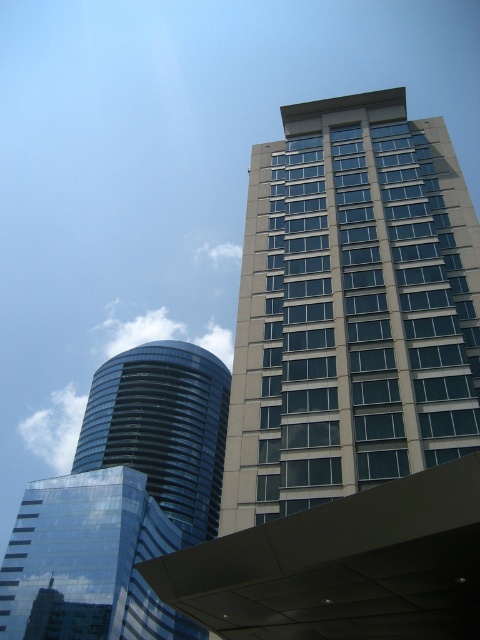
You are a drone operator flying a drone that needs to navigate between the beige glass building at upper right and the glossy glass building at lower left. Based on their positions, which building is located higher up in the image?

The beige glass building at upper right is positioned over the glossy glass building at lower left, so it is higher up in the image.

You are an architect analyzing the urban skyline. You observe the glossy glass building at lower left and the shiny glass tower at center left. Which of these two buildings appears taller in the image?

The glossy glass building at lower left appears taller than the shiny glass tower at center left in the image.

You are an architect analyzing the urban layout. Given that the shiny glass tower at center left and the beige glass building at upper right are both part of the city skyline, which one would require a wider base to maintain structural stability?

The shiny glass tower at center left requires a wider base to maintain structural stability because it has a greater width than the beige glass building at upper right, as stated in the description.